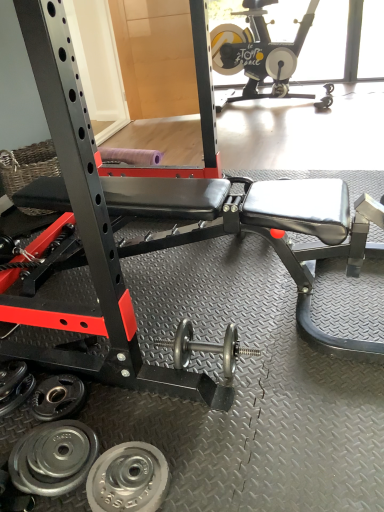
Find the location of a particular element. vacant area that lies to the right of polished silver dumbbell at center is located at coordinates (284, 360).